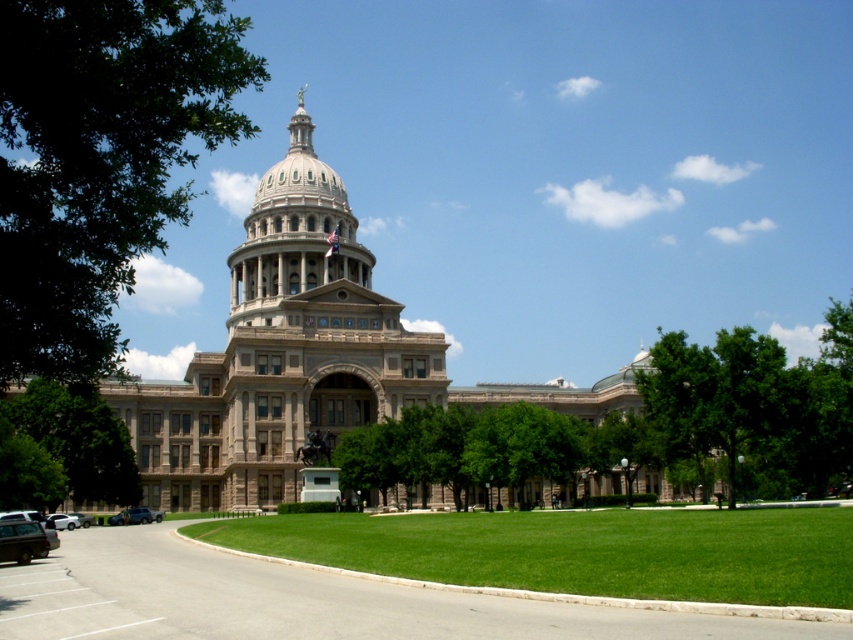
Question: Can you confirm if green leafy tree at left is thinner than matte black truck at lower left?

Choices:
 (A) no
 (B) yes

Answer: (A)

Question: From the image, what is the correct spatial relationship of metallic silver sedan at lower left in relation to silver metallic sedan at lower left?

Choices:
 (A) above
 (B) below

Answer: (A)

Question: Which point appears farthest from the camera in this image?

Choices:
 (A) (296, 157)
 (B) (10, 560)
 (C) (78, 522)
 (D) (70, 428)

Answer: (A)

Question: Estimate the real-world distances between objects in this image. Which object is closer to the silver metallic sedan at lower left?

Choices:
 (A) white matte car at lower left
 (B) green leafy tree at left

Answer: (A)

Question: Can you confirm if green leafy tree at upper left is positioned to the left of matte black truck at lower left?

Choices:
 (A) no
 (B) yes

Answer: (B)

Question: Considering the real-world distances, which object is closest to the green leafy tree at upper left?

Choices:
 (A) silver metallic sedan at lower left
 (B) beige stone dome at center

Answer: (B)